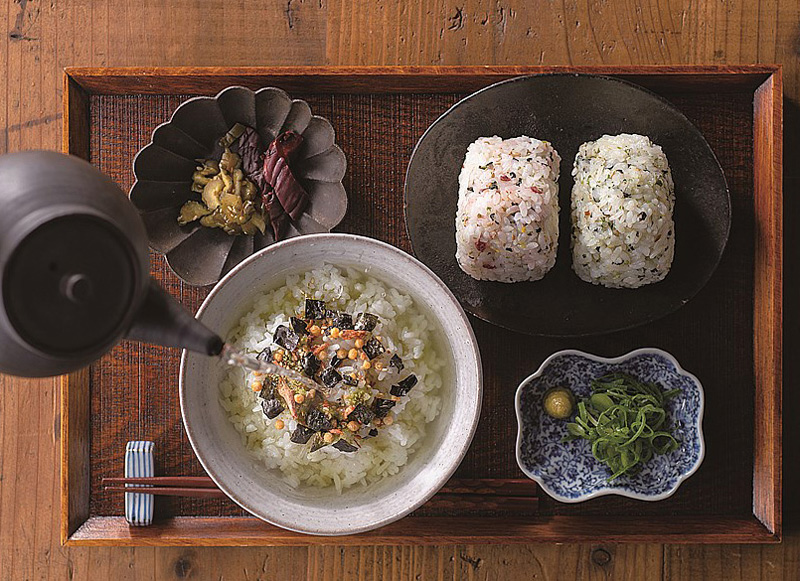
Identify the location of ceramic. The width and height of the screenshot is (800, 581). (465, 414), (533, 400), (324, 178), (406, 178), (50, 223), (138, 460).